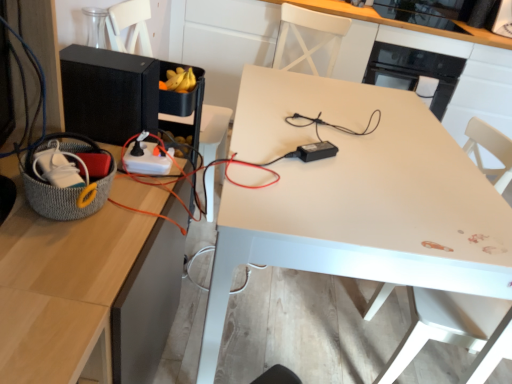
Question: Choose the correct answer: Is black glossy microwave at upper right, the 1th appliance when ordered from right to left, inside white plastic swivel chair at center or outside it?

Choices:
 (A) outside
 (B) inside

Answer: (A)

Question: From the image's perspective, is black glossy microwave at upper right, the 3th appliance positioned from the bottom, located above or below white plastic swivel chair at center?

Choices:
 (A) below
 (B) above

Answer: (B)

Question: Which object is positioned farthest from the white glossy table at center?

Choices:
 (A) black matte speaker at left, the 1th appliance from the left
 (B) white plastic extension cord at lower left
 (C) black plastic power adapter at center, the 3th appliance in the back-to-front sequence
 (D) knitted gray basket at left
 (E) white plastic swivel chair at center

Answer: (D)

Question: Which of these objects is positioned closest to the white plastic extension cord at lower left?

Choices:
 (A) knitted gray basket at left
 (B) white glossy table at center
 (C) white plastic swivel chair at center
 (D) black matte speaker at left, the 1th appliance from the left
 (E) black glossy microwave at upper right, which ranks as the first appliance in top-to-bottom order

Answer: (D)